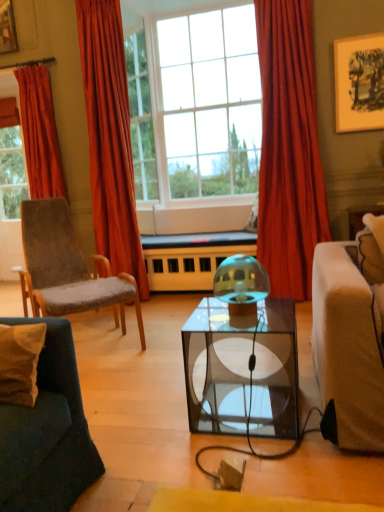
Where is `unoccupied area behind transparent glass coffee table at center`? The width and height of the screenshot is (384, 512). unoccupied area behind transparent glass coffee table at center is located at coordinates (230, 369).